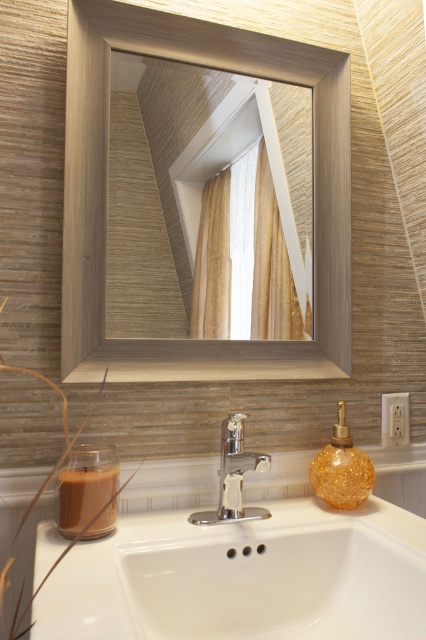
Question: Which point is closer to the camera taking this photo?

Choices:
 (A) (267, 465)
 (B) (181, 154)
 (C) (209, 240)
 (D) (129, 548)

Answer: (D)

Question: Is matte wood mirror at upper center further to the viewer compared to white ceramic sink at center?

Choices:
 (A) yes
 (B) no

Answer: (A)

Question: Which point is closer to the camera taking this photo?

Choices:
 (A) (207, 214)
 (B) (104, 605)
 (C) (232, 477)
 (D) (123, 256)

Answer: (B)

Question: Is matte wood mirror at upper center in front of white textured curtain at upper center?

Choices:
 (A) yes
 (B) no

Answer: (A)

Question: Which object is the farthest from the matte wood mirror at upper center?

Choices:
 (A) white textured curtain at upper center
 (B) white ceramic sink at center

Answer: (B)

Question: Is matte wood mirror at upper center behind white textured curtain at upper center?

Choices:
 (A) yes
 (B) no

Answer: (B)